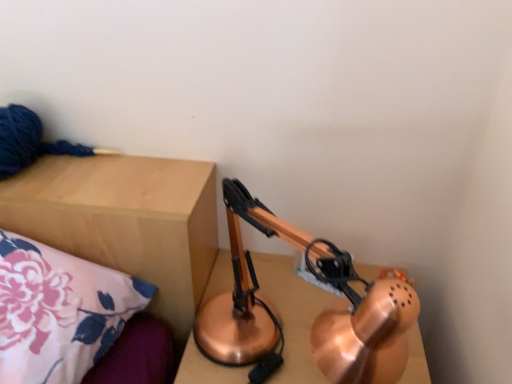
Find the location of a particular element. empty space that is ontop of copper metallic lamp at center (from a real-world perspective) is located at coordinates click(x=296, y=301).